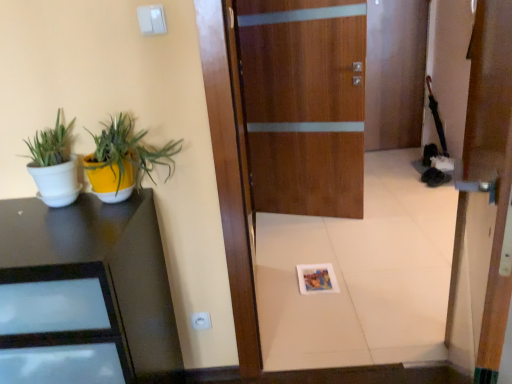
Question: Does white matte pot at left, which is the second houseplant in right-to-left order, turn towards wooden door at center, marked as the first door in a front-to-back arrangement?

Choices:
 (A) no
 (B) yes

Answer: (A)

Question: From the image's perspective, is white matte pot at left, the first houseplant from the left, below wooden door at center, marked as the first door in a front-to-back arrangement?

Choices:
 (A) yes
 (B) no

Answer: (B)

Question: Does white matte pot at left, which is the second houseplant in right-to-left order, lie behind wooden door at center, arranged as the second door when viewed from the back?

Choices:
 (A) yes
 (B) no

Answer: (A)

Question: Considering the relative sizes of white matte pot at left, the first houseplant from the left, and wooden door at center, arranged as the second door when viewed from the back, in the image provided, is white matte pot at left, the first houseplant from the left, taller than wooden door at center, arranged as the second door when viewed from the back,?

Choices:
 (A) yes
 (B) no

Answer: (B)

Question: From a real-world perspective, is white matte pot at left, which is the second houseplant in right-to-left order, under wooden door at center, marked as the first door in a front-to-back arrangement?

Choices:
 (A) yes
 (B) no

Answer: (B)

Question: In terms of height, does black glossy desk at left look taller or shorter compared to yellow matte pot at left, which appears as the first houseplant when viewed from the right?

Choices:
 (A) tall
 (B) short

Answer: (A)

Question: Based on their positions, is black glossy desk at left located to the left or right of yellow matte pot at left, which appears as the first houseplant when viewed from the right?

Choices:
 (A) left
 (B) right

Answer: (A)

Question: In the image, is black glossy desk at left positioned in front of or behind yellow matte pot at left, which appears as the first houseplant when viewed from the right?

Choices:
 (A) behind
 (B) front

Answer: (B)

Question: From the image's perspective, is black glossy desk at left positioned above or below yellow matte pot at left, the second houseplant from the left?

Choices:
 (A) above
 (B) below

Answer: (B)

Question: Is white plastic electric outlet at lower center taller or shorter than yellow matte pot at left, which appears as the first houseplant when viewed from the right?

Choices:
 (A) tall
 (B) short

Answer: (B)

Question: In terms of width, does white plastic electric outlet at lower center look wider or thinner when compared to yellow matte pot at left, the second houseplant from the left?

Choices:
 (A) wide
 (B) thin

Answer: (B)

Question: Do you think white plastic electric outlet at lower center is within yellow matte pot at left, which appears as the first houseplant when viewed from the right, or outside of it?

Choices:
 (A) outside
 (B) inside

Answer: (A)

Question: Does point (203, 319) appear closer or farther from the camera than point (108, 168)?

Choices:
 (A) closer
 (B) farther

Answer: (B)

Question: In terms of height, does white matte pot at left, the first houseplant from the left, look taller or shorter compared to black glossy desk at left?

Choices:
 (A) tall
 (B) short

Answer: (B)

Question: In the image, is white matte pot at left, the first houseplant from the left, positioned in front of or behind black glossy desk at left?

Choices:
 (A) behind
 (B) front

Answer: (A)